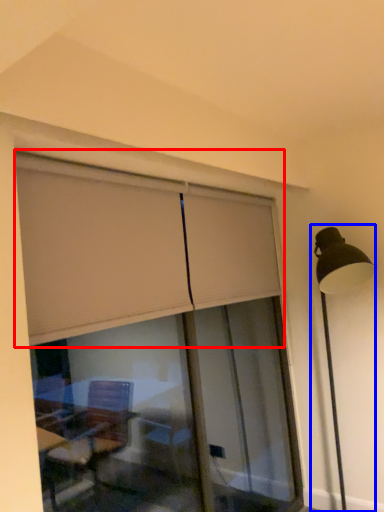
Question: Which of the following is the closest to the observer, curtain (highlighted by a red box) or lamp post (highlighted by a blue box)?

Choices:
 (A) curtain
 (B) lamp post

Answer: (A)